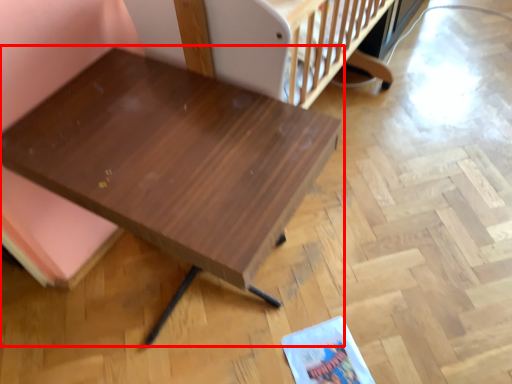
Question: In this image, where is table (annotated by the red box) located relative to infant bed?

Choices:
 (A) right
 (B) left

Answer: (B)